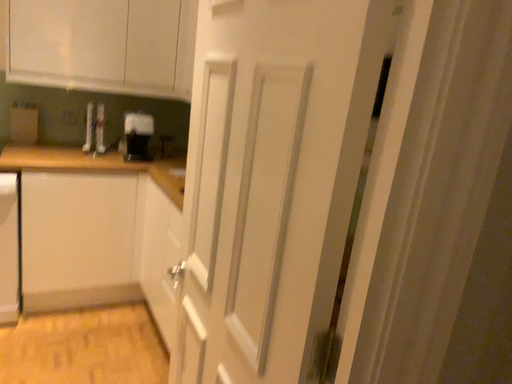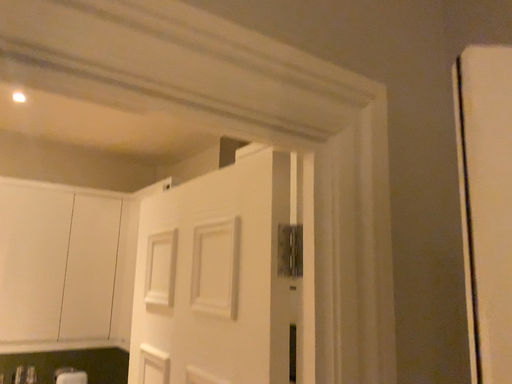
Question: Which way did the camera rotate in the video?

Choices:
 (A) rotated downward
 (B) rotated upward

Answer: (B)